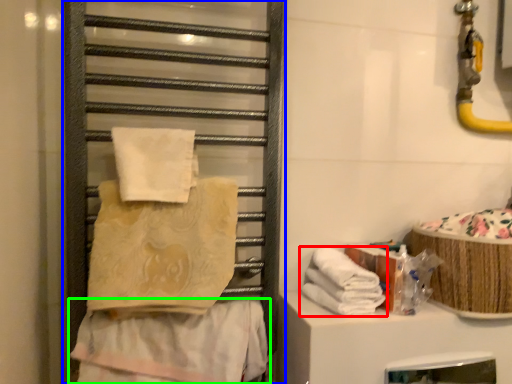
Question: Considering the real-world distances, which object is closest to towel (highlighted by a red box)? cage (highlighted by a blue box) or towel (highlighted by a green box).

Choices:
 (A) cage
 (B) towel

Answer: (B)